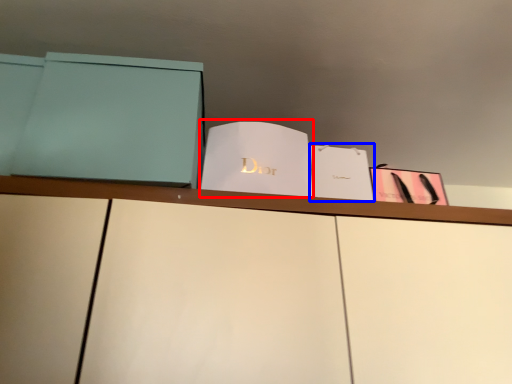
Question: Which object is closer to the camera taking this photo, paperback book (highlighted by a red box) or paperback book (highlighted by a blue box)?

Choices:
 (A) paperback book
 (B) paperback book

Answer: (A)